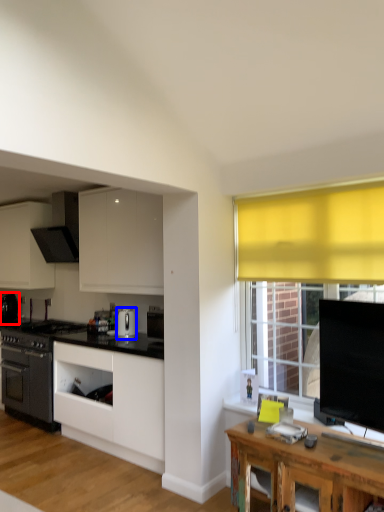
Question: Which object is closer to the camera taking this photo, kitchen appliance (highlighted by a red box) or kitchen appliance (highlighted by a blue box)?

Choices:
 (A) kitchen appliance
 (B) kitchen appliance

Answer: (B)